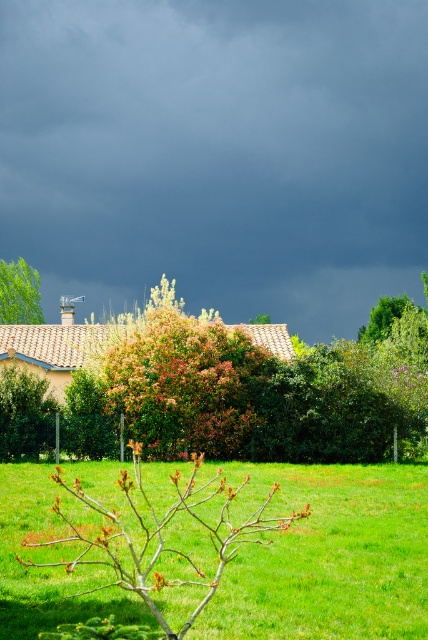
You are a gardener assessing the landscape. You notice the dark gray cloud at upper center and the green grass at lower center. Which object is higher in the scene?

The dark gray cloud at upper center is taller than the green grass at lower center.

You are standing in the middle of the scene and want to walk towards the house with the terracotta roof. Which direction should you walk relative to the green leafy tree at center and the green leafy tree at left?

You should walk between the green leafy tree at center and the green leafy tree at left because the house is behind the trees. Since the green leafy tree at center is to the right of the green leafy tree at left, walking between them would lead you towards the house in the background.